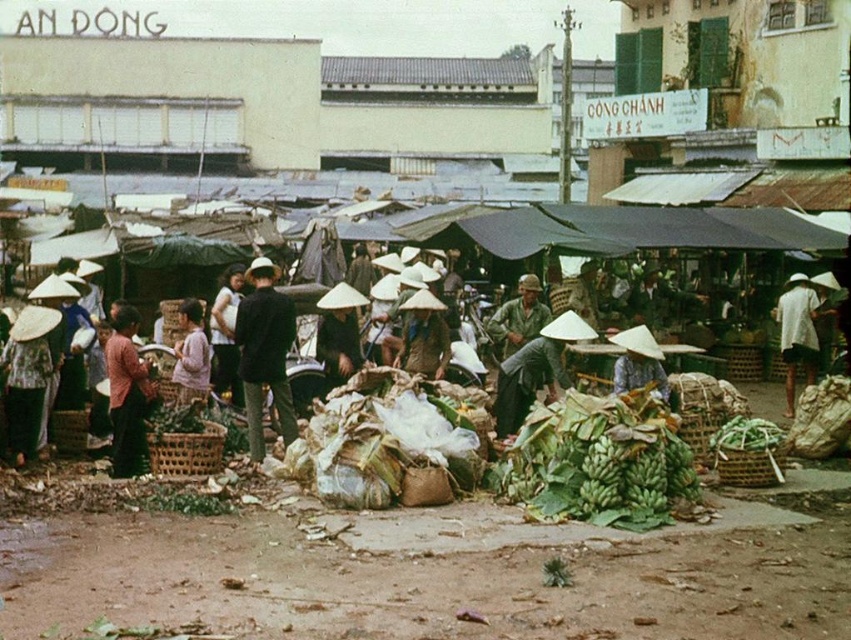
Can you confirm if dark brown leather jacket at center is positioned above matte brown woven basket at center?

Actually, dark brown leather jacket at center is below matte brown woven basket at center.

Does dark brown leather jacket at center have a lesser width compared to matte brown woven basket at center?

Correct, dark brown leather jacket at center's width is less than matte brown woven basket at center's.

This screenshot has width=851, height=640. I want to click on dark brown leather jacket at center, so click(264, 353).

Where is `dark brown leather jacket at center`? This screenshot has width=851, height=640. dark brown leather jacket at center is located at coordinates 264,353.

Who is lower down, light brown fabric shirt at center or green leafy vegetables at center?

green leafy vegetables at center

Does light brown fabric shirt at center have a smaller size compared to green leafy vegetables at center?

No.

Is point (227, 358) less distant than point (722, 440)?

That is False.

Locate an element on the screen. This screenshot has width=851, height=640. light brown fabric shirt at center is located at coordinates (226, 336).

Which is behind, point (213, 387) or point (617, 392)?

Positioned behind is point (213, 387).

Between point (230, 364) and point (623, 380), which one is positioned behind?

Point (230, 364)

Identify the location of light brown fabric shirt at center. The width and height of the screenshot is (851, 640). (226, 336).